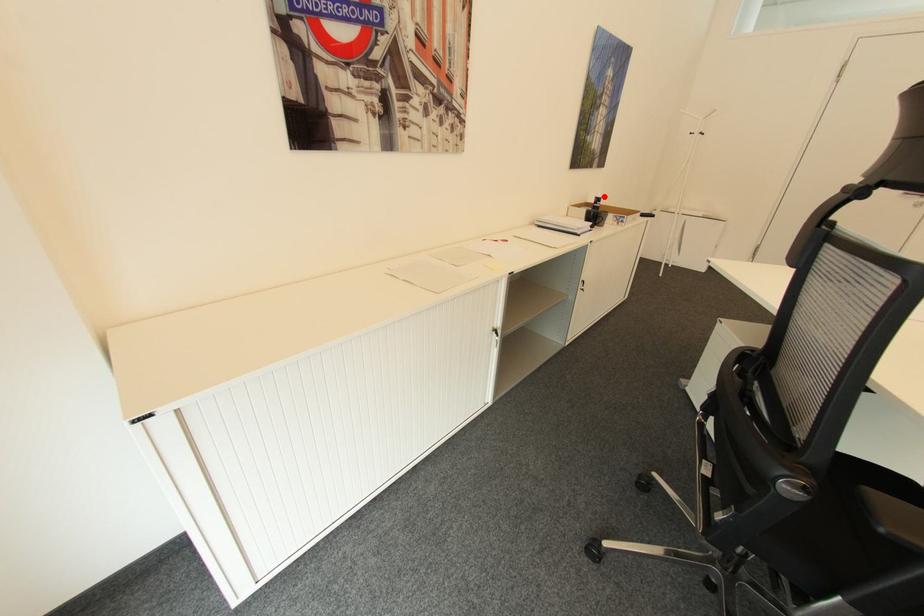
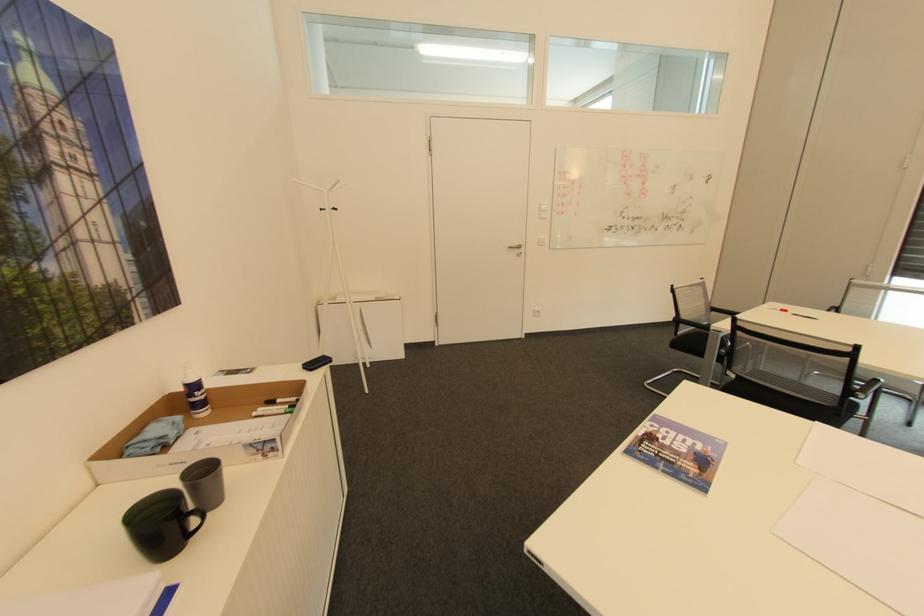
In the second image, find the point that corresponds to the highlighted location in the first image.

(197, 379)